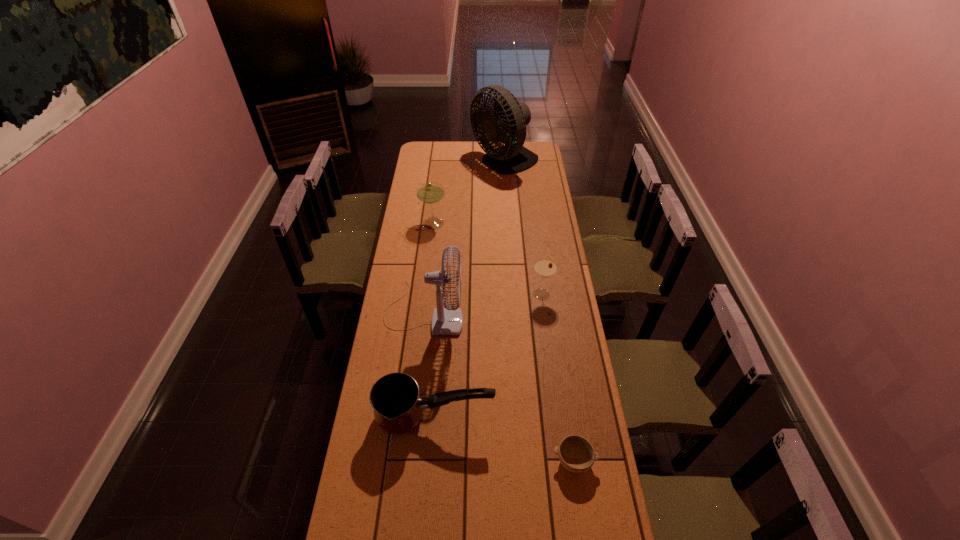
Where is `the nearest object`? The image size is (960, 540). the nearest object is located at coordinates (576, 454).

Find the location of a particular element. The width and height of the screenshot is (960, 540). free location located 0.240m in front of the farther fan to direct airflow is located at coordinates (431, 163).

At what (x,y) coordinates should I click in order to perform the action: click on vacant area located 0.160m in front of the farther fan to direct airflow. Please return your answer as a coordinate pair (x, y). Image resolution: width=960 pixels, height=540 pixels. Looking at the image, I should click on (444, 163).

Locate an element on the screen. The width and height of the screenshot is (960, 540). free space located in front of the farther fan to direct airflow is located at coordinates (421, 163).

This screenshot has height=540, width=960. In order to click on vacant region located 0.190m on the front-facing side of the shorter fan in this screenshot , I will do `click(509, 312)`.

Where is `vacant space located on the back of the left martini`? The height and width of the screenshot is (540, 960). vacant space located on the back of the left martini is located at coordinates (441, 180).

Where is `vacant area situated 0.170m on the left of the nearer martini`? vacant area situated 0.170m on the left of the nearer martini is located at coordinates (491, 294).

The height and width of the screenshot is (540, 960). In order to click on blank space located on the handle side of the second nearest object in this screenshot , I will do `click(540, 417)`.

This screenshot has width=960, height=540. I want to click on vacant region located 0.320m on the back of the shortest object, so click(x=560, y=362).

Find the location of a particular element. object situated at the far edge is located at coordinates (507, 122).